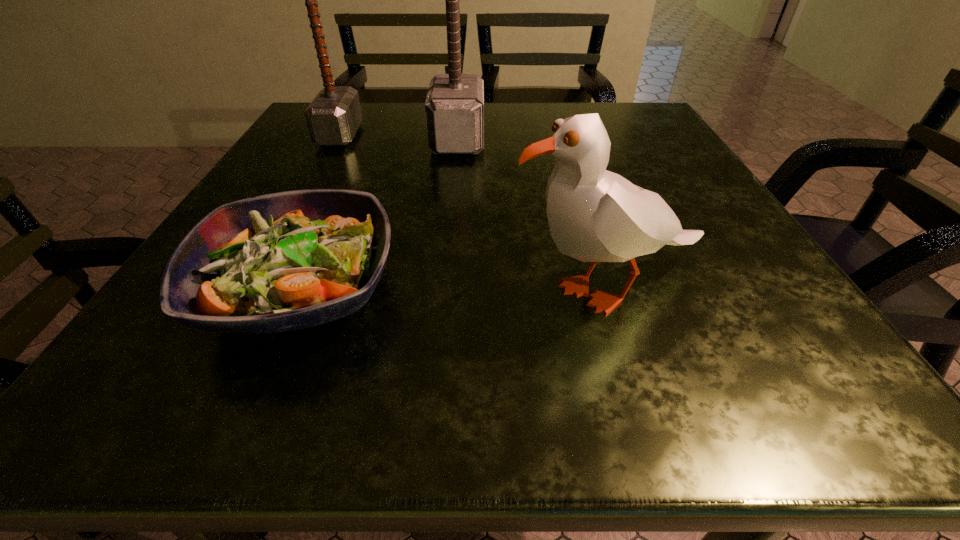
In order to click on the right hammer in this screenshot , I will do `click(454, 106)`.

Image resolution: width=960 pixels, height=540 pixels. I want to click on the left hammer, so coord(333,117).

What are the coordinates of `the third tallest object` in the screenshot? It's located at (594, 215).

I want to click on gull, so click(x=594, y=215).

At what (x,y) coordinates should I click in order to perform the action: click on the shortest object. Please return your answer as a coordinate pair (x, y). The image size is (960, 540). Looking at the image, I should click on click(285, 261).

The width and height of the screenshot is (960, 540). What are the coordinates of `free region located for striking with the head of the second object from right to left` in the screenshot? It's located at (606, 140).

Image resolution: width=960 pixels, height=540 pixels. Find the location of `vacant region located 0.360m on the striking surface of the left hammer`. vacant region located 0.360m on the striking surface of the left hammer is located at coordinates (518, 135).

Find the location of a particular element. The width and height of the screenshot is (960, 540). free location located 0.340m at the beak of the rightmost object is located at coordinates (264, 291).

You are a GUI agent. You are given a task and a screenshot of the screen. Output one action in this format:
    pyautogui.click(x=<x>, y=<y>)
    Task: Click on the vacant space situated 0.110m at the beak of the rightmost object
    This screenshot has height=540, width=960.
    Given the screenshot: What is the action you would take?
    pyautogui.click(x=428, y=291)

The image size is (960, 540). I want to click on vacant space positioned at the beak of the rightmost object, so (x=278, y=291).